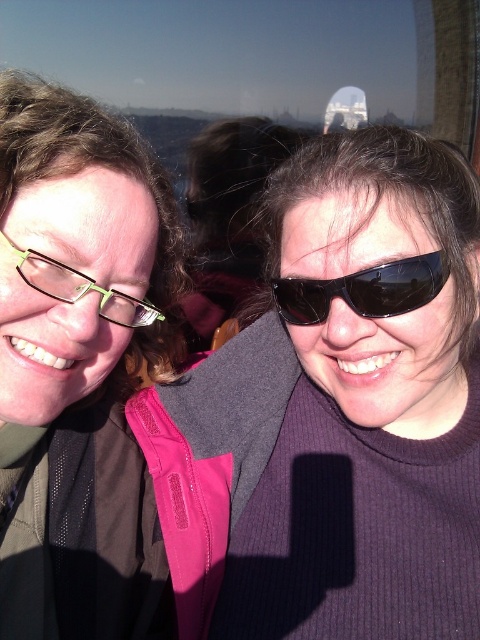
You are standing in front of the two people in the image and want to place a small gift between them. The gift must be placed closer to the person who is nearer to you. Which point should you choose between point (99,536) and point (147,305)?

Point (99,536) is further to the viewer than point (147,305), so you should place the gift closer to point (99,536) since that person is nearer to you.

You are a photographer trying to focus on the black reflective sunglasses at center. What are the coordinates you should aim for?

The coordinates for the black reflective sunglasses at center are at point (x=363, y=289).